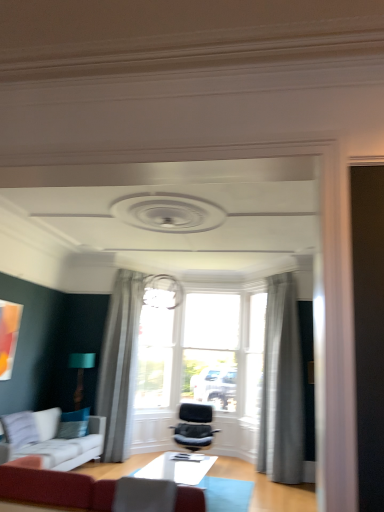
Question: From the image's perspective, is white glossy table at center beneath teal fabric pillow at lower left?

Choices:
 (A) yes
 (B) no

Answer: (A)

Question: Is white glossy table at center in front of teal fabric pillow at lower left?

Choices:
 (A) no
 (B) yes

Answer: (B)

Question: Is white glossy table at center at the left side of teal fabric pillow at lower left?

Choices:
 (A) no
 (B) yes

Answer: (A)

Question: Does white glossy table at center have a lesser width compared to teal fabric pillow at lower left?

Choices:
 (A) yes
 (B) no

Answer: (B)

Question: Does white glossy table at center lie behind teal fabric pillow at lower left?

Choices:
 (A) yes
 (B) no

Answer: (B)

Question: Does point (62, 416) appear closer or farther from the camera than point (279, 283)?

Choices:
 (A) farther
 (B) closer

Answer: (B)

Question: From a real-world perspective, relative to sheer gray curtain at upper center, the 2th curtain when ordered from left to right, is teal fabric pillow at lower left vertically above or below?

Choices:
 (A) above
 (B) below

Answer: (B)

Question: From the image's perspective, is teal fabric pillow at lower left positioned above or below sheer gray curtain at upper center, arranged as the 1th curtain when viewed from the right?

Choices:
 (A) above
 (B) below

Answer: (B)

Question: Is teal fabric pillow at lower left wider or thinner than sheer gray curtain at upper center, arranged as the 1th curtain when viewed from the right?

Choices:
 (A) thin
 (B) wide

Answer: (A)

Question: In terms of width, does velvet red sofa at lower left, which appears as the second studio couch when viewed from the back, look wider or thinner when compared to velvet black chair at center?

Choices:
 (A) wide
 (B) thin

Answer: (B)

Question: From a real-world perspective, is velvet red sofa at lower left, marked as the 1th studio couch in a right-to-left arrangement, physically located above or below velvet black chair at center?

Choices:
 (A) below
 (B) above

Answer: (B)

Question: Does point (66, 477) appear closer or farther from the camera than point (205, 410)?

Choices:
 (A) closer
 (B) farther

Answer: (A)

Question: Considering the relative positions of velvet red sofa at lower left, marked as the 1th studio couch in a right-to-left arrangement, and velvet black chair at center in the image provided, is velvet red sofa at lower left, marked as the 1th studio couch in a right-to-left arrangement, to the left or to the right of velvet black chair at center?

Choices:
 (A) left
 (B) right

Answer: (A)

Question: Looking at their shapes, would you say teal fabric lampshade at lower left is wider or thinner than gray sheer curtain at center, arranged as the 2th curtain when viewed from the right?

Choices:
 (A) wide
 (B) thin

Answer: (B)

Question: Would you say teal fabric lampshade at lower left is to the left or to the right of gray sheer curtain at center, marked as the 1th curtain in a left-to-right arrangement, in the picture?

Choices:
 (A) left
 (B) right

Answer: (A)